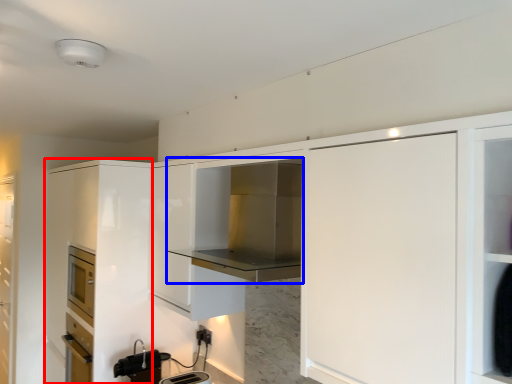
Question: Which object is closer to the camera taking this photo, cabinetry (highlighted by a red box) or cabinetry (highlighted by a blue box)?

Choices:
 (A) cabinetry
 (B) cabinetry

Answer: (B)